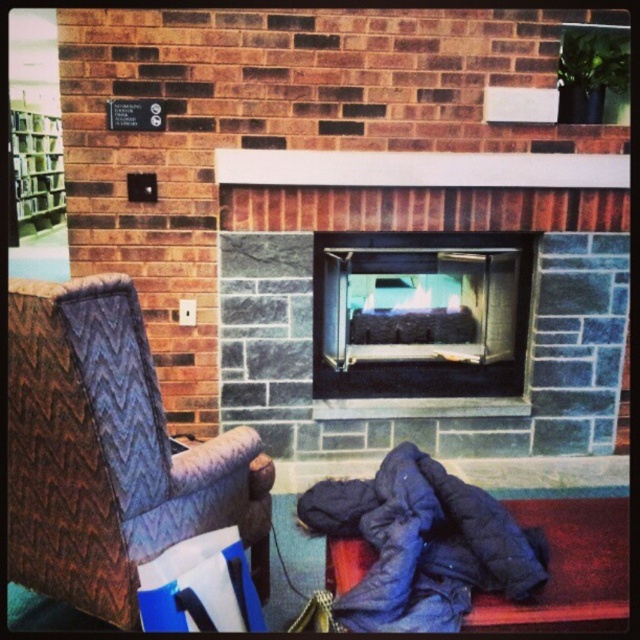
You are sitting on the brown quilted fabric armchair at left and want to reach the dark blue quilted sleeping bag at lower right. Which direction should you move to get closer to it?

You should move to the right because the brown quilted fabric armchair at left is positioned to the left of the dark blue quilted sleeping bag at lower right, so moving right will bring you closer.

You are standing in the living room and want to place a decorative item on the gray stone fireplace at center. If your arm reaches out 1.5 meters, can you place the item without moving closer?

The gray stone fireplace at center is 3.07 meters away from viewer. Since your arm only reaches 1.5 meters, you cannot reach it without moving closer.